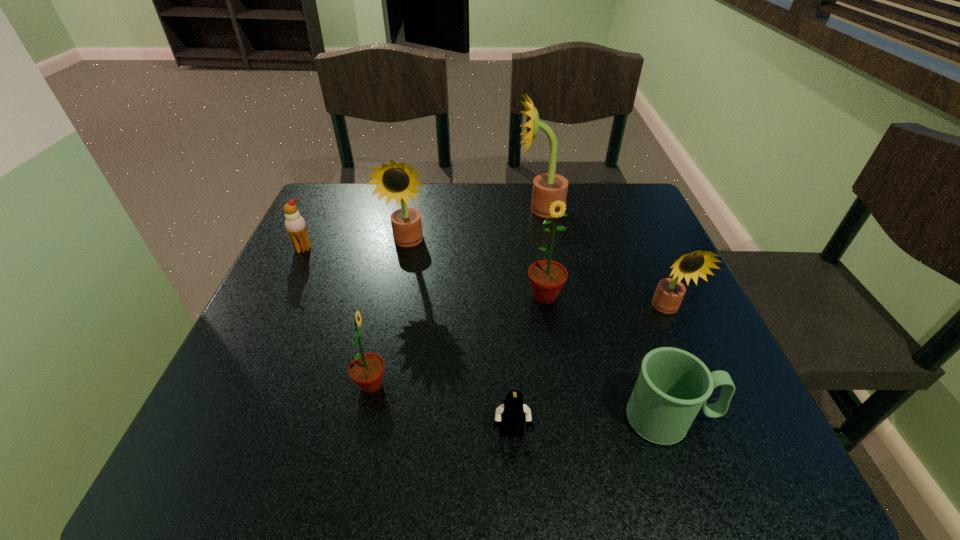
The image size is (960, 540). Identify the location of icecream. (295, 224).

Image resolution: width=960 pixels, height=540 pixels. I want to click on green mug, so (x=673, y=385).

Locate an element on the screen. This screenshot has height=540, width=960. the shortest object is located at coordinates (513, 413).

What are the coordinates of `Lego` in the screenshot? It's located at click(513, 413).

This screenshot has width=960, height=540. Identify the location of free space located on the face of the biggest yellow sunflower. (440, 209).

This screenshot has width=960, height=540. What are the coordinates of `free space located 0.340m on the face of the biggest yellow sunflower` in the screenshot? It's located at (387, 209).

Where is `free space located on the face of the biggest yellow sunflower`? free space located on the face of the biggest yellow sunflower is located at coordinates (489, 209).

You are a GUI agent. You are given a task and a screenshot of the screen. Output one action in this format:
    pyautogui.click(x=<x>, y=<y>)
    Task: Click on the vacant position located on the face of the farther green sunflower
    The image size is (960, 540).
    Given the screenshot: What is the action you would take?
    pyautogui.click(x=569, y=454)

What are the coordinates of `free space located on the face of the second farthest yellow sunflower` in the screenshot? It's located at (397, 295).

This screenshot has width=960, height=540. I want to click on free region located on the face of the nearest sunflower, so click(452, 385).